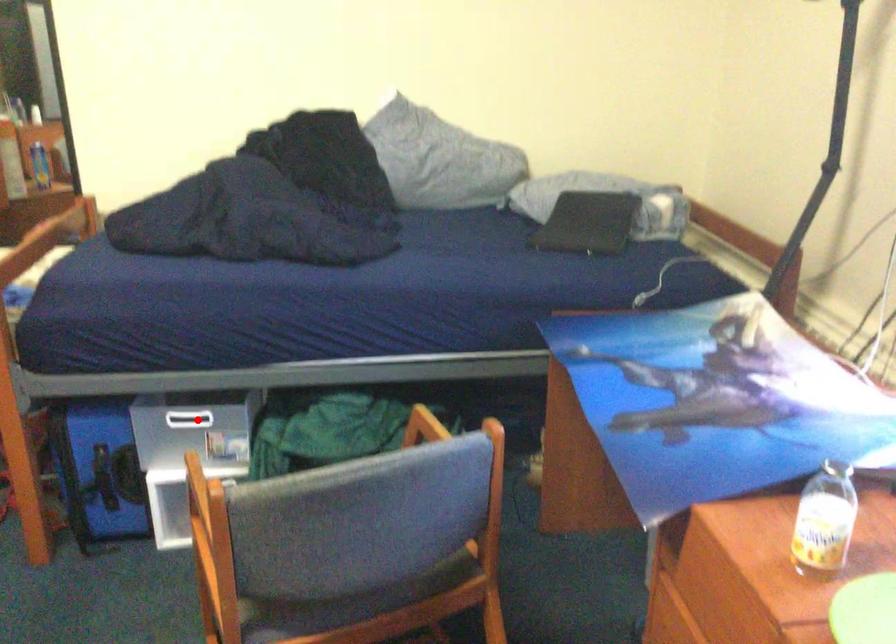
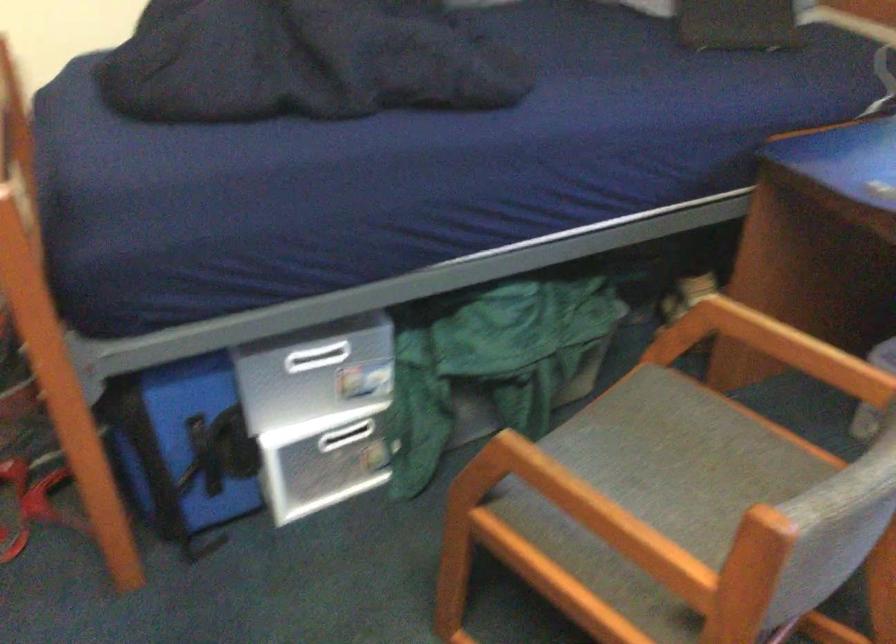
Question: I am providing you with two images of the same scene from different viewpoints. In image1, a red point is highlighted. Considering the same 3D point in image2, which of the following is correct?

Choices:
 (A) It is closer
 (B) It is farther

Answer: (A)